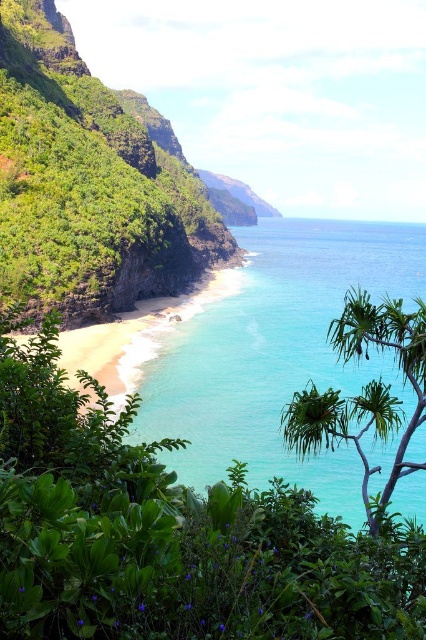
From the picture: You are standing at the edge of the beach and see two points marked on the image. Which point, point (299, 291) or point (373, 305), is closer to you?

Point (299, 291) is closer to you because it is further to the viewer than point (373, 305).